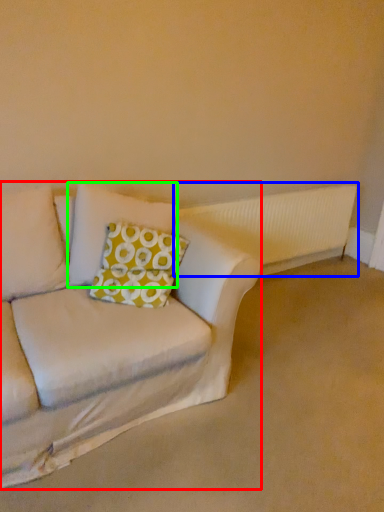
Question: Which object is positioned closest to studio couch (highlighted by a red box)? Select from radiator (highlighted by a blue box) and pillow (highlighted by a green box).

Choices:
 (A) radiator
 (B) pillow

Answer: (B)